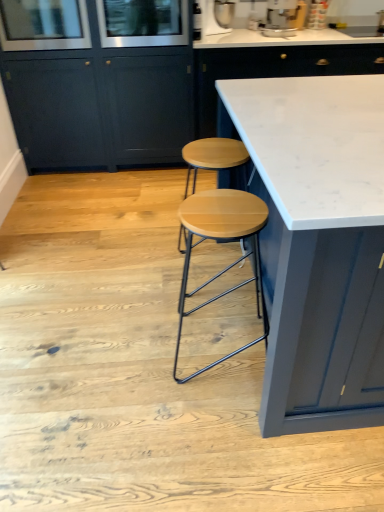
Where is `free space above wooden seat stool at center (from a real-world perspective)`? The width and height of the screenshot is (384, 512). free space above wooden seat stool at center (from a real-world perspective) is located at coordinates (223, 212).